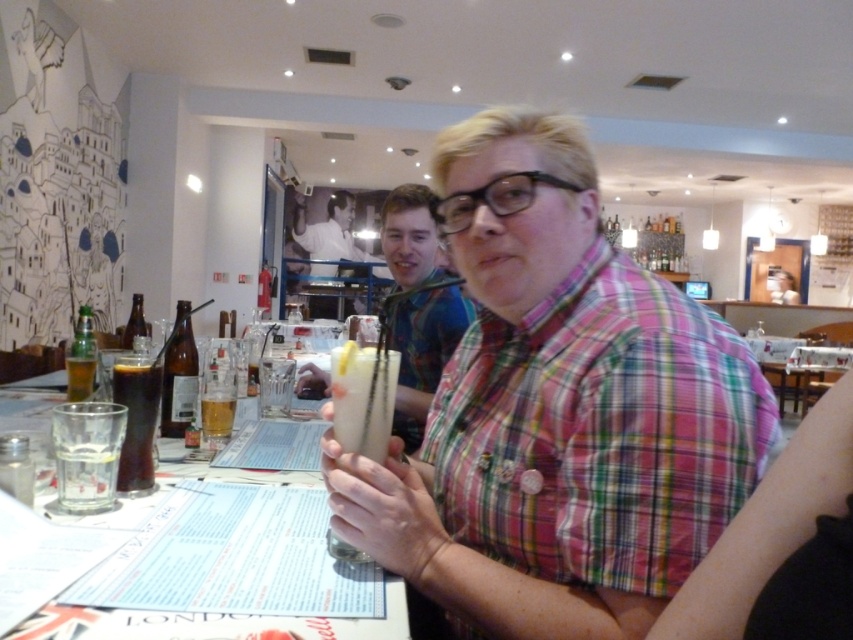
Is point (669, 561) less distant than point (146, 330)?

That is True.

Is matte blue shirt at center to the left of brown glass bottle at center from the viewer's perspective?

In fact, matte blue shirt at center is to the right of brown glass bottle at center.

Does point (550, 202) come behind point (136, 317)?

No.

In order to click on matte blue shirt at center in this screenshot , I will do `click(558, 412)`.

Between clear glass at lower left and translucent glass bottle at left, which one is positioned lower?

clear glass at lower left is lower down.

Does clear glass at lower left appear on the left side of translucent glass bottle at left?

Incorrect, clear glass at lower left is not on the left side of translucent glass bottle at left.

Which is in front, point (62, 477) or point (68, 385)?

Point (62, 477)

Where is `clear glass at lower left`? clear glass at lower left is located at coordinates (86, 476).

Which is below, translucent glass bottle at center or translucent glass at table center?

translucent glass at table center is below.

Who is more forward, (173, 397) or (204, 419)?

Point (204, 419) is more forward.

In order to click on translucent glass bottle at center in this screenshot , I will do pos(178,374).

Where is `translucent glass bottle at center`? translucent glass bottle at center is located at coordinates (178, 374).